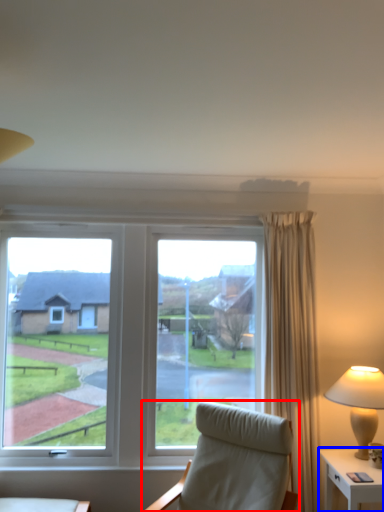
Question: Which object is further to the camera taking this photo, chair (highlighted by a red box) or nightstand (highlighted by a blue box)?

Choices:
 (A) chair
 (B) nightstand

Answer: (B)